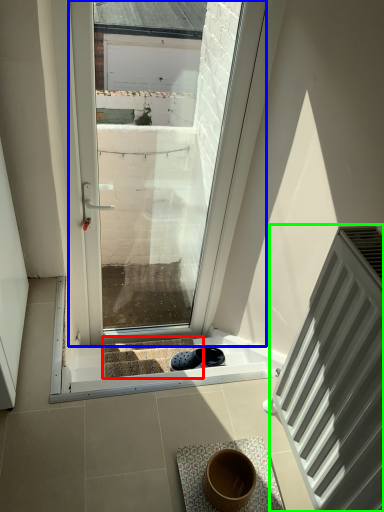
Question: Which is nearer to the stairwell (highlighted by a red box)? window (highlighted by a blue box) or radiator (highlighted by a green box).

Choices:
 (A) window
 (B) radiator

Answer: (B)